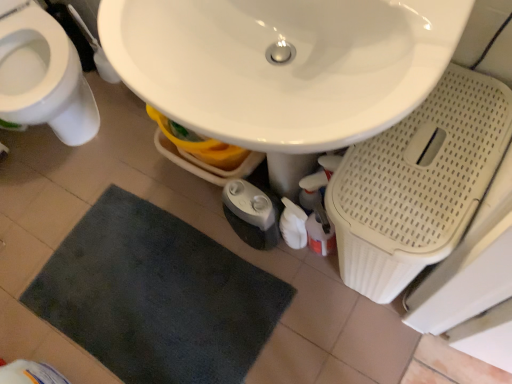
This screenshot has height=384, width=512. Identify the location of free space in front of white glossy toilet at left. (82, 202).